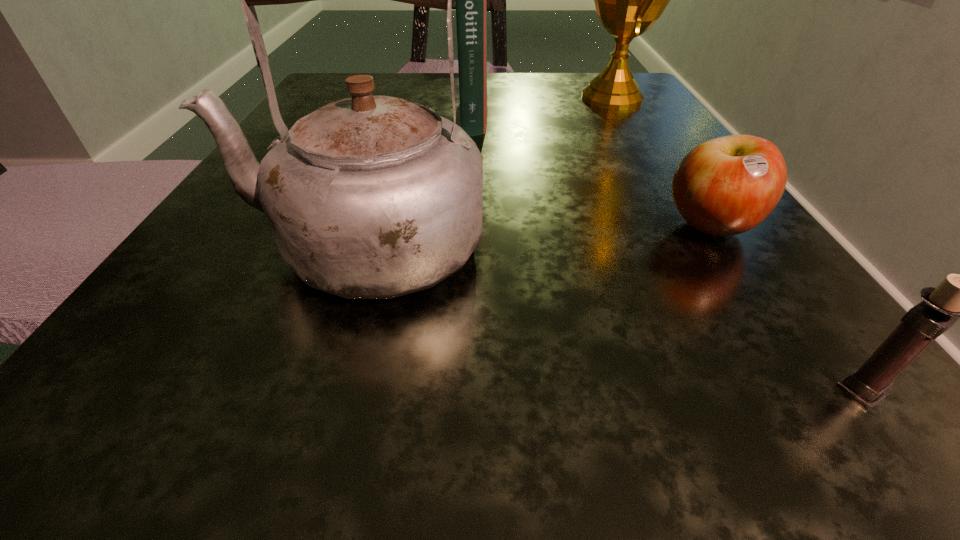
Find the location of a particular element. free spot between the shortest object and the candle holder is located at coordinates (785, 309).

The image size is (960, 540). What are the coordinates of `free space between the award and the candle holder` in the screenshot? It's located at (x=736, y=245).

The height and width of the screenshot is (540, 960). Find the location of `vacant space that is in between the award and the hardback book`. vacant space that is in between the award and the hardback book is located at coordinates (542, 105).

This screenshot has width=960, height=540. Identify the location of free space that is in between the hardback book and the nearest object. (667, 252).

This screenshot has height=540, width=960. I want to click on free space between the apple and the kettle, so click(537, 236).

Find the location of a particular element. The height and width of the screenshot is (540, 960). unoccupied area between the apple and the award is located at coordinates (660, 163).

Find the location of a particular element. Image resolution: width=960 pixels, height=540 pixels. vacant area between the kettle and the award is located at coordinates [x=488, y=172].

Where is `unoccupied position between the award and the kettle`? The width and height of the screenshot is (960, 540). unoccupied position between the award and the kettle is located at coordinates (488, 172).

At what (x,y) coordinates should I click in order to perform the action: click on object that is the fourth closest to the nearest object. Please return your answer as a coordinate pair (x, y). This screenshot has width=960, height=540. Looking at the image, I should click on (471, 10).

Identify which object is the second closest to the apple. Please provide its 2D coordinates. Your answer should be formatted as a tuple, i.e. [(x, y)], where the tuple contains the x and y coordinates of a point satisfying the conditions above.

[(371, 197)]